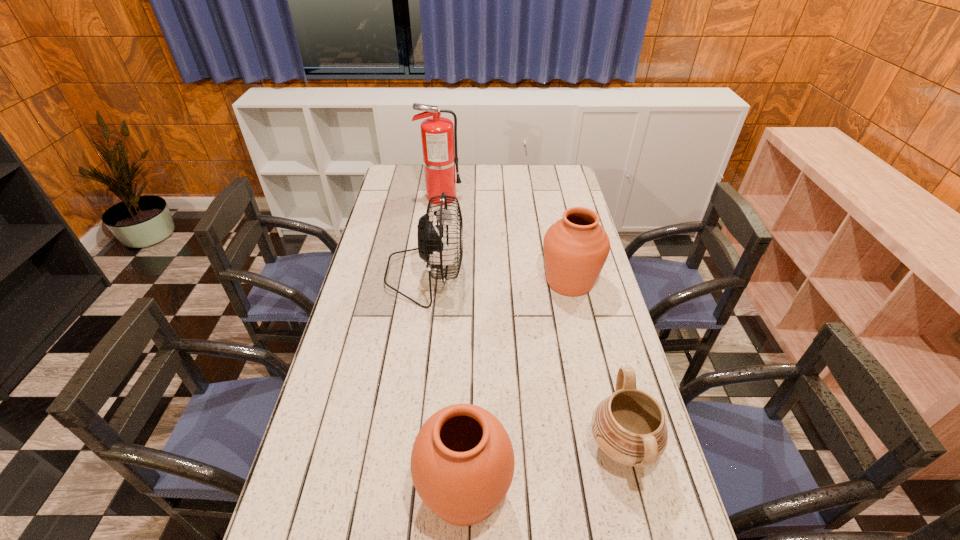
Find the location of `the tallest object`. the tallest object is located at coordinates (438, 134).

Locate an element on the screen. The width and height of the screenshot is (960, 540). fire extinguisher is located at coordinates [x=438, y=134].

Image resolution: width=960 pixels, height=540 pixels. Find the location of `fan`. fan is located at coordinates (431, 238).

Locate an element on the screen. This screenshot has height=540, width=960. the farthest urn is located at coordinates (576, 247).

Locate an element on the screen. This screenshot has height=540, width=960. the shortest object is located at coordinates (629, 426).

You are a GUI agent. You are given a task and a screenshot of the screen. Output one action in this format:
    pyautogui.click(x=<x>, y=<y>)
    Task: Click on the blank area located 0.310m at the nozzle of the farthest object
    The width and height of the screenshot is (960, 540).
    Given the screenshot: What is the action you would take?
    pyautogui.click(x=530, y=197)

This screenshot has width=960, height=540. Identify the location of vacant space located in front of the fan, directing airflow. (477, 275).

Identify the location of blank space located 0.390m on the back of the farthest urn. point(553,205).

Where is `vacant area situated 0.200m on the front-facing side of the shortest urn`? The height and width of the screenshot is (540, 960). vacant area situated 0.200m on the front-facing side of the shortest urn is located at coordinates (509, 446).

You are a GUI agent. You are given a task and a screenshot of the screen. Output one action in this format:
    pyautogui.click(x=<x>, y=<y>)
    Task: Click on the vacant point located 0.280m on the front-facing side of the shortest urn
    This screenshot has height=540, width=960.
    Given the screenshot: What is the action you would take?
    pyautogui.click(x=477, y=446)